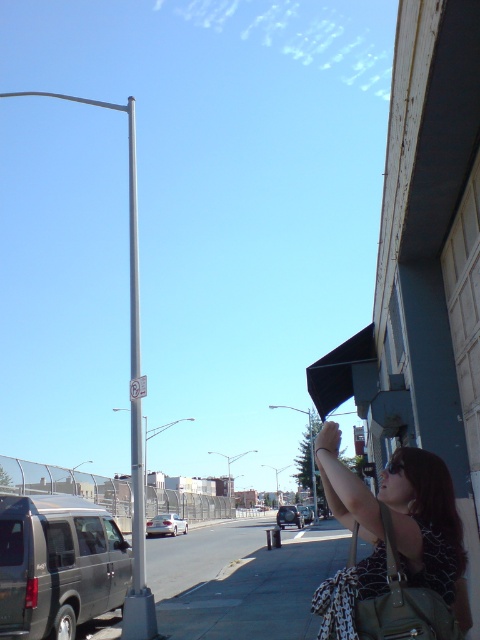
Question: Which of the following is the closest to the observer?

Choices:
 (A) (303, 509)
 (B) (180, 522)
 (C) (109, 598)
 (D) (212, 618)

Answer: (C)

Question: Does leopard print dress at lower right come in front of white plastic sign at center?

Choices:
 (A) yes
 (B) no

Answer: (A)

Question: Which of these objects is positioned closest to the white plastic sign at center?

Choices:
 (A) metallic silver sedan at center
 (B) polished silver pole at center
 (C) matte black van at lower left
 (D) silver metallic sedan at center

Answer: (C)

Question: Which object is farther from the camera taking this photo?

Choices:
 (A) gray concrete sidewalk at lower center
 (B) metallic silver sedan at center
 (C) leopard print dress at lower right

Answer: (B)

Question: Does leopard print dress at lower right come behind metallic silver sedan at center?

Choices:
 (A) yes
 (B) no

Answer: (B)

Question: Does matte black van at lower left appear on the left side of silver metallic car at center?

Choices:
 (A) yes
 (B) no

Answer: (A)